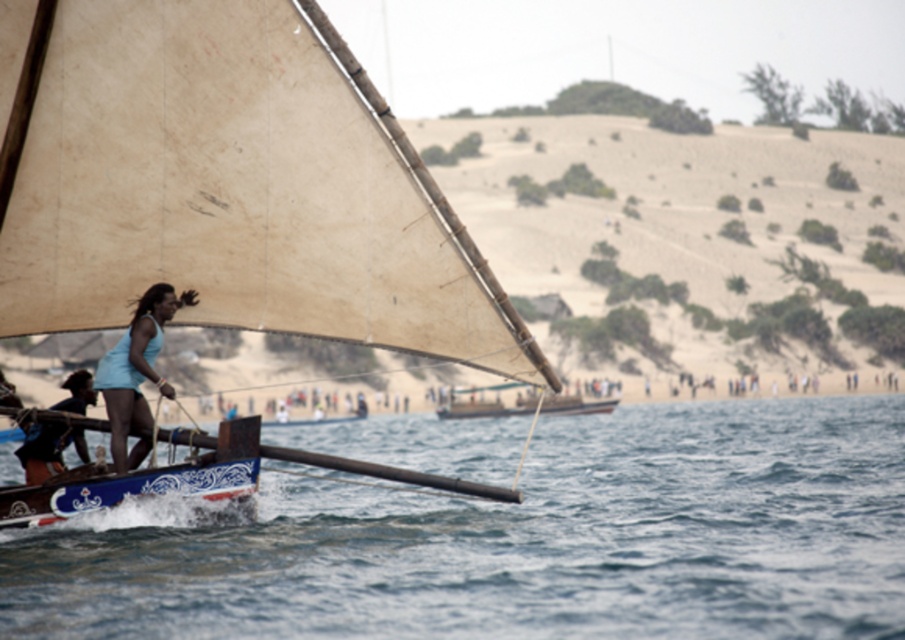
Question: Does beige canvas sailboat at left have a larger size compared to light blue fabric at center?

Choices:
 (A) yes
 (B) no

Answer: (A)

Question: Does blue painted wood boat at lower left appear over light blue fabric at center?

Choices:
 (A) no
 (B) yes

Answer: (A)

Question: Which of the following is the closest to the observer?

Choices:
 (A) (449, 348)
 (B) (144, 445)
 (C) (98, 490)
 (D) (322, 621)

Answer: (D)

Question: Which is nearer to the light blue fabric at center?

Choices:
 (A) matte blue tank top at left
 (B) blue painted wood boat at lower left
 (C) blue water at lower left
 (D) beige canvas sailboat at left

Answer: (B)

Question: Is light blue fabric at center behind matte blue tank top at left?

Choices:
 (A) no
 (B) yes

Answer: (A)

Question: Estimate the real-world distances between objects in this image. Which object is farther from the beige canvas sailboat at left?

Choices:
 (A) light blue fabric at center
 (B) blue painted wood boat at lower left
 (C) blue water at lower left

Answer: (C)